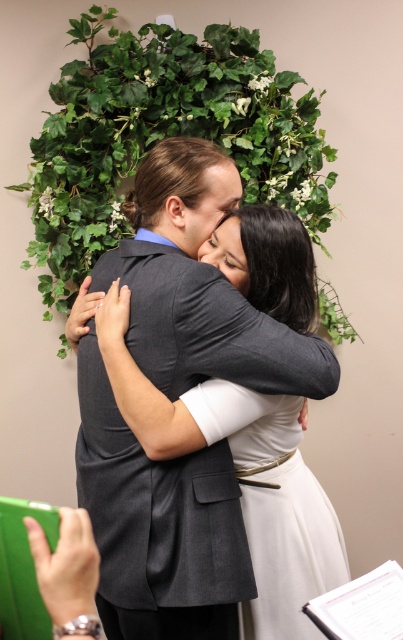
You are a photographer standing at the back of the scene. You want to take a photo of the dark gray suit at center and the green leafy ivy at upper center in the same frame. Can you position yourself so that both are visible without moving any objects?

The dark gray suit at center is 38.28 inches away from the green leafy ivy at upper center. Since the distance between them is less than the camera lens field of view, you can position yourself to capture both in the same frame without moving any objects.

You are taking a photo of the two people in the embrace. You want to focus on the person on the left first. Which point, point (213, 221) or point (155, 44), should you adjust your camera focus to ensure the person on the left is in sharp focus?

Point (213, 221) should be used because it is closer to the camera, ensuring the person on the left is in focus.